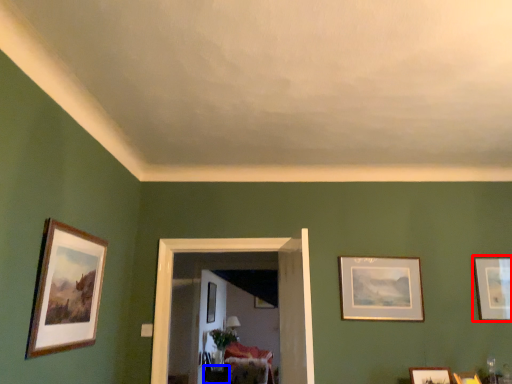
Question: Which object is closer to the camera taking this photo, picture frame (highlighted by a red box) or table (highlighted by a blue box)?

Choices:
 (A) picture frame
 (B) table

Answer: (A)